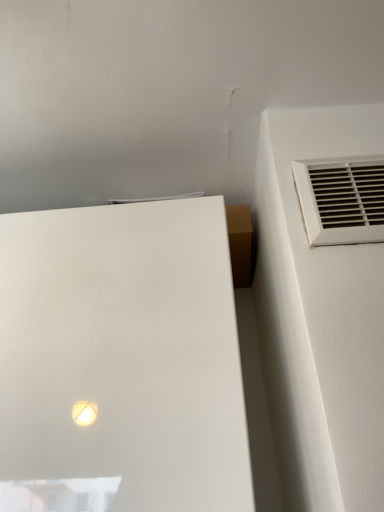
You are a GUI agent. You are given a task and a screenshot of the screen. Output one action in this format:
    pyautogui.click(x=<x>, y=<y>)
    Task: Click on the white plastic vent at upper right
    The image size is (384, 512).
    Given the screenshot: What is the action you would take?
    pyautogui.click(x=341, y=199)

Describe the element at coordinates (341, 199) in the screenshot. I see `white plastic vent at upper right` at that location.

At what (x,y) coordinates should I click in order to perform the action: click on white plastic vent at upper right. Please return your answer as a coordinate pair (x, y). Image resolution: width=384 pixels, height=512 pixels. Looking at the image, I should click on (341, 199).